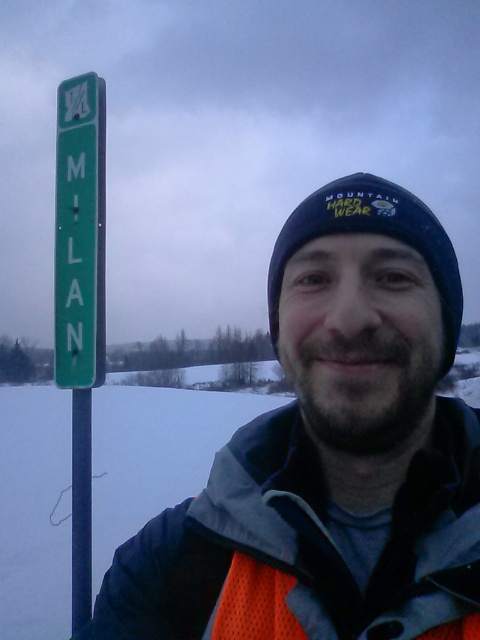
Is the position of matte black beanie at upper center more distant than that of orange mesh vest at center?

No, it is not.

Which is below, matte black beanie at upper center or orange mesh vest at center?

Positioned lower is orange mesh vest at center.

In order to click on matte black beanie at upper center in this screenshot , I will do pos(331,454).

Is matte black beanie at upper center to the right of green plastic sign at left from the viewer's perspective?

Indeed, matte black beanie at upper center is positioned on the right side of green plastic sign at left.

Image resolution: width=480 pixels, height=640 pixels. What do you see at coordinates (331, 454) in the screenshot?
I see `matte black beanie at upper center` at bounding box center [331, 454].

I want to click on matte black beanie at upper center, so (331, 454).

Does green plastic sign at left appear on the left side of orange mesh vest at center?

Correct, you'll find green plastic sign at left to the left of orange mesh vest at center.

Can you confirm if green plastic sign at left is shorter than orange mesh vest at center?

In fact, green plastic sign at left may be taller than orange mesh vest at center.

Which is in front, point (88, 237) or point (280, 573)?

Point (280, 573) is in front.

I want to click on green plastic sign at left, so click(80, 232).